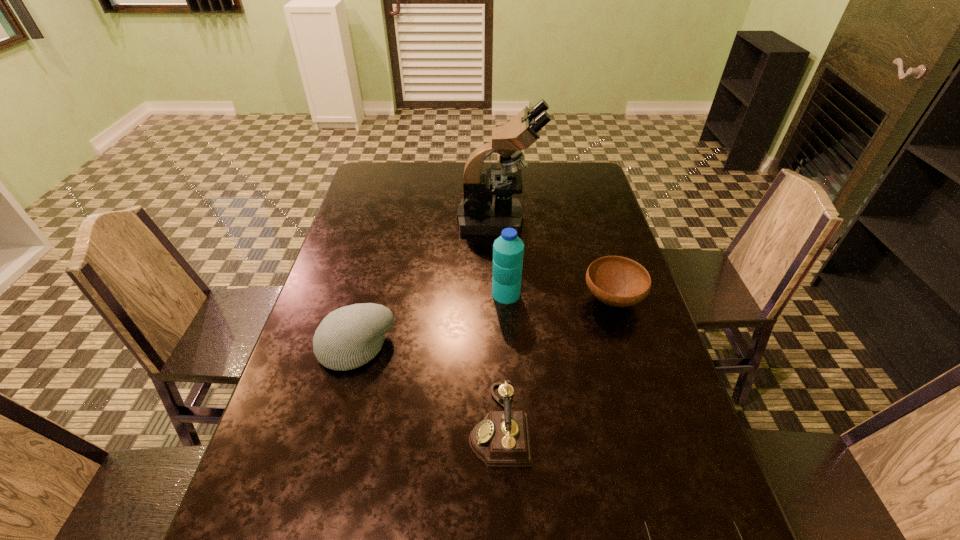
You are a GUI agent. You are given a task and a screenshot of the screen. Output one action in this format:
    pyautogui.click(x=<x>, y=<y>)
    Task: Click on the microscope
    
    Given the screenshot: What is the action you would take?
    pyautogui.click(x=479, y=213)

Where is `the farthest object`? This screenshot has width=960, height=540. the farthest object is located at coordinates (479, 213).

I want to click on the second tallest object, so click(508, 249).

Image resolution: width=960 pixels, height=540 pixels. In order to click on the fourth farthest object in this screenshot , I will do `click(349, 337)`.

The image size is (960, 540). In order to click on beanie in this screenshot , I will do `click(349, 337)`.

This screenshot has height=540, width=960. Find the location of `the second nearest object`. the second nearest object is located at coordinates (502, 439).

Locate an element on the screen. The image size is (960, 540). bowl is located at coordinates (617, 281).

Identify the location of vacant space situated 0.090m on the front of the farthest object. Image resolution: width=960 pixels, height=540 pixels. (500, 253).

What are the coordinates of `free space located on the front of the fifth shortest object` in the screenshot? It's located at (511, 364).

You are a GUI agent. You are given a task and a screenshot of the screen. Output one action in this format:
    pyautogui.click(x=<x>, y=<y>)
    Task: Click on the vacant space situated on the right of the third nearest object
    The width and height of the screenshot is (960, 540).
    Given the screenshot: What is the action you would take?
    pyautogui.click(x=541, y=347)